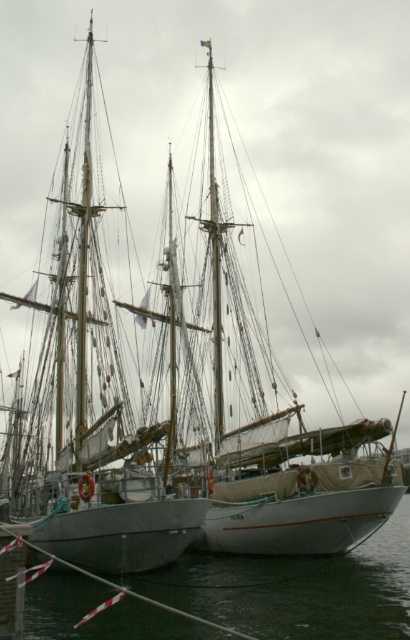
You are a dock worker who needs to ensure that the wooden sailboat at left and the black rubber water at lower center can fit through a narrow channel. Based on their widths, which one might have difficulty passing through the channel first if the channel is only wide enough for the narrower object?

The wooden sailboat at left has a lesser width compared to black rubber water at lower center, so the wooden sailboat at left is narrower and would pass through the channel first, while the black rubber water at lower center might have difficulty due to its wider width.

You are standing at the center of the marina and want to locate the wooden sailboat at left. According to the coordinates provided, in which direction should you look to find it?

The wooden sailboat at left is located at coordinates point (x=97, y=388), so you should look to the left side of the marina to find it.